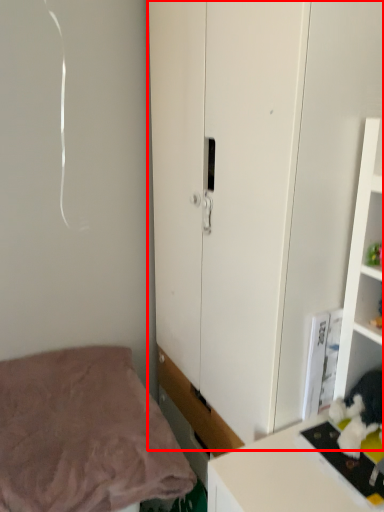
Question: From the image's perspective, what is the correct spatial relationship of cupboard (annotated by the red box) in relation to bed?

Choices:
 (A) below
 (B) above

Answer: (B)